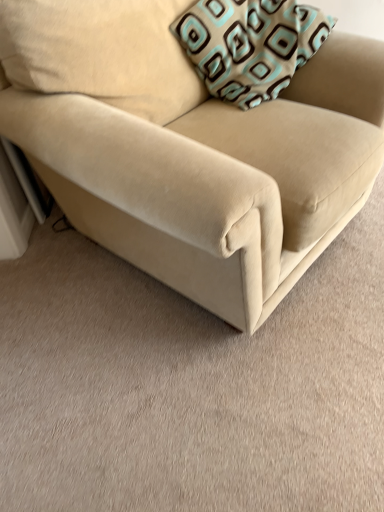
Locate an element on the screen. This screenshot has height=512, width=384. teal-patterned fabric pillow at upper right is located at coordinates (250, 45).

The width and height of the screenshot is (384, 512). What do you see at coordinates (250, 45) in the screenshot? I see `teal-patterned fabric pillow at upper right` at bounding box center [250, 45].

Measure the distance between beige fabric couch at center and camera.

32.41 inches.

Describe the element at coordinates (189, 148) in the screenshot. The width and height of the screenshot is (384, 512). I see `beige fabric couch at center` at that location.

Locate an element on the screen. Image resolution: width=384 pixels, height=512 pixels. beige fabric couch at center is located at coordinates (189, 148).

The width and height of the screenshot is (384, 512). I want to click on teal-patterned fabric pillow at upper right, so click(x=250, y=45).

In the image, is beige fabric couch at center on the left side or the right side of teal-patterned fabric pillow at upper right?

Clearly, beige fabric couch at center is on the left of teal-patterned fabric pillow at upper right in the image.

Considering the positions of objects beige fabric couch at center and teal-patterned fabric pillow at upper right in the image provided, who is behind, beige fabric couch at center or teal-patterned fabric pillow at upper right?

Positioned behind is teal-patterned fabric pillow at upper right.

Is point (68, 207) closer to camera compared to point (258, 96)?

No, it is not.

From the image's perspective, would you say beige fabric couch at center is positioned over teal-patterned fabric pillow at upper right?

Actually, beige fabric couch at center appears below teal-patterned fabric pillow at upper right in the image.

From a real-world perspective, is beige fabric couch at center physically located above or below teal-patterned fabric pillow at upper right?

In terms of real-world spatial position, beige fabric couch at center is below teal-patterned fabric pillow at upper right.

Between beige fabric couch at center and teal-patterned fabric pillow at upper right, which one has smaller width?

Thinner between the two is teal-patterned fabric pillow at upper right.

Considering the sizes of objects beige fabric couch at center and teal-patterned fabric pillow at upper right in the image provided, who is shorter, beige fabric couch at center or teal-patterned fabric pillow at upper right?

teal-patterned fabric pillow at upper right.

Does beige fabric couch at center have a smaller size compared to teal-patterned fabric pillow at upper right?

No.

Do you think beige fabric couch at center is within teal-patterned fabric pillow at upper right, or outside of it?

beige fabric couch at center is not inside teal-patterned fabric pillow at upper right, it's outside.

Are beige fabric couch at center and teal-patterned fabric pillow at upper right far apart?

That's not correct — beige fabric couch at center is a little close to teal-patterned fabric pillow at upper right.

Is beige fabric couch at center oriented away from teal-patterned fabric pillow at upper right?

Yes, beige fabric couch at center is positioned with its back facing teal-patterned fabric pillow at upper right.

How far apart are beige fabric couch at center and teal-patterned fabric pillow at upper right?

The distance of beige fabric couch at center from teal-patterned fabric pillow at upper right is 11.36 inches.

Find the location of a particular element. The image size is (384, 512). throw pillow behind the beige fabric couch at center is located at coordinates (250, 45).

Between teal-patterned fabric pillow at upper right and beige fabric couch at center, which one appears on the right side from the viewer's perspective?

teal-patterned fabric pillow at upper right.

In the image, is teal-patterned fabric pillow at upper right positioned in front of or behind beige fabric couch at center?

teal-patterned fabric pillow at upper right is behind beige fabric couch at center.

Which is in front, point (236, 66) or point (68, 58)?

Positioned in front is point (68, 58).

From the image's perspective, between teal-patterned fabric pillow at upper right and beige fabric couch at center, who is located below?

beige fabric couch at center appears lower in the image.

From a real-world perspective, is teal-patterned fabric pillow at upper right located higher than beige fabric couch at center?

Yes, from a real-world perspective, teal-patterned fabric pillow at upper right is over beige fabric couch at center

Considering the sizes of objects teal-patterned fabric pillow at upper right and beige fabric couch at center in the image provided, who is thinner, teal-patterned fabric pillow at upper right or beige fabric couch at center?

teal-patterned fabric pillow at upper right.

Considering the relative sizes of teal-patterned fabric pillow at upper right and beige fabric couch at center in the image provided, is teal-patterned fabric pillow at upper right taller than beige fabric couch at center?

In fact, teal-patterned fabric pillow at upper right may be shorter than beige fabric couch at center.

Looking at the image, does teal-patterned fabric pillow at upper right seem bigger or smaller compared to beige fabric couch at center?

Considering their sizes, teal-patterned fabric pillow at upper right takes up less space than beige fabric couch at center.

Is teal-patterned fabric pillow at upper right spatially inside beige fabric couch at center, or outside of it?

teal-patterned fabric pillow at upper right is located inside beige fabric couch at center.

Are teal-patterned fabric pillow at upper right and beige fabric couch at center far apart?

No, teal-patterned fabric pillow at upper right is not far from beige fabric couch at center.

Is teal-patterned fabric pillow at upper right aimed at beige fabric couch at center?

Yes, teal-patterned fabric pillow at upper right is aimed at beige fabric couch at center.

Identify the location of throw pillow that appears behind the beige fabric couch at center. (250, 45).

You are a GUI agent. You are given a task and a screenshot of the screen. Output one action in this format:
    pyautogui.click(x=<x>, y=<y>)
    Task: Click on the throw pillow above the beige fabric couch at center (from the image's perspective)
    The image size is (384, 512).
    Given the screenshot: What is the action you would take?
    pyautogui.click(x=250, y=45)

At what (x,y) coordinates should I click in order to perform the action: click on throw pillow above the beige fabric couch at center (from a real-world perspective). Please return your answer as a coordinate pair (x, y). The image size is (384, 512). Looking at the image, I should click on (250, 45).